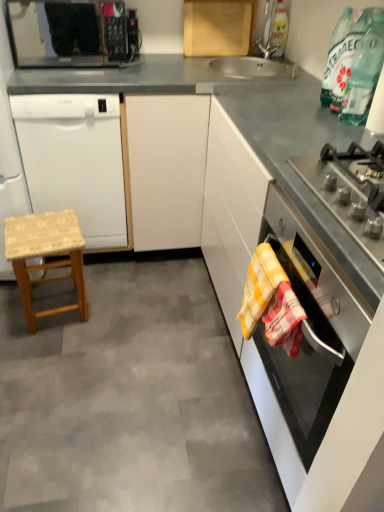
Question: From a real-world perspective, does black matte microwave at upper left stand above wooden stool at left?

Choices:
 (A) no
 (B) yes

Answer: (B)

Question: Is black matte microwave at upper left oriented away from wooden stool at left?

Choices:
 (A) yes
 (B) no

Answer: (B)

Question: Are black matte microwave at upper left and wooden stool at left located far from each other?

Choices:
 (A) no
 (B) yes

Answer: (B)

Question: Are black matte microwave at upper left and wooden stool at left making contact?

Choices:
 (A) yes
 (B) no

Answer: (B)

Question: Does black matte microwave at upper left appear on the left side of wooden stool at left?

Choices:
 (A) no
 (B) yes

Answer: (B)

Question: In terms of size, does yellow checkered towel at lower right, the second blanket when ordered from front to back, appear bigger or smaller than white matte dishwasher at left?

Choices:
 (A) small
 (B) big

Answer: (A)

Question: In the image, is yellow checkered towel at lower right, which is the first blanket in back-to-front order, on the left side or the right side of white matte dishwasher at left?

Choices:
 (A) left
 (B) right

Answer: (B)

Question: In terms of height, does yellow checkered towel at lower right, which is the first blanket in back-to-front order, look taller or shorter compared to white matte dishwasher at left?

Choices:
 (A) tall
 (B) short

Answer: (B)

Question: Is yellow checkered towel at lower right, the second blanket when ordered from front to back, spatially inside white matte dishwasher at left, or outside of it?

Choices:
 (A) outside
 (B) inside

Answer: (A)

Question: Would you say yellow checkered towel at lower right, which is the first blanket in back-to-front order, is to the left or to the right of satin silver gas stove at right in the picture?

Choices:
 (A) right
 (B) left

Answer: (B)

Question: Is yellow checkered towel at lower right, the second blanket when ordered from front to back, in front of or behind satin silver gas stove at right in the image?

Choices:
 (A) behind
 (B) front

Answer: (A)

Question: From the image's perspective, relative to satin silver gas stove at right, is yellow checkered towel at lower right, which is the first blanket in back-to-front order, above or below?

Choices:
 (A) below
 (B) above

Answer: (A)

Question: Is point (251, 309) positioned closer to the camera than point (347, 181)?

Choices:
 (A) farther
 (B) closer

Answer: (A)

Question: Would you say yellow checkered towel at lower right, which is the second blanket in back-to-front order, is inside or outside transparent glass bottle at upper right?

Choices:
 (A) outside
 (B) inside

Answer: (A)

Question: Is yellow checkered towel at lower right, arranged as the first blanket when viewed from the front, to the left or to the right of transparent glass bottle at upper right in the image?

Choices:
 (A) left
 (B) right

Answer: (A)